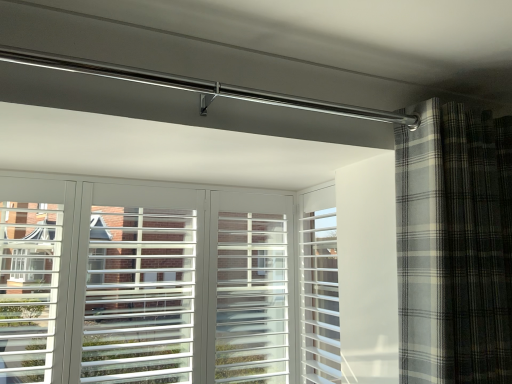
Question: Can white plastic screen door at center be found inside plaid fabric curtain at right?

Choices:
 (A) no
 (B) yes

Answer: (A)

Question: From a real-world perspective, is plaid fabric curtain at right beneath white plastic screen door at center?

Choices:
 (A) yes
 (B) no

Answer: (B)

Question: Is plaid fabric curtain at right shorter than white plastic screen door at center?

Choices:
 (A) yes
 (B) no

Answer: (A)

Question: Is white plastic screen door at center at the back of plaid fabric curtain at right?

Choices:
 (A) yes
 (B) no

Answer: (A)

Question: Considering the relative sizes of plaid fabric curtain at right and white plastic screen door at center in the image provided, is plaid fabric curtain at right thinner than white plastic screen door at center?

Choices:
 (A) no
 (B) yes

Answer: (A)

Question: Is plaid fabric curtain at right aimed at white plastic screen door at center?

Choices:
 (A) yes
 (B) no

Answer: (B)

Question: From the image's perspective, does white plastic screen door at center appear higher than plaid fabric curtain at right?

Choices:
 (A) yes
 (B) no

Answer: (B)

Question: Can you confirm if white plastic screen door at center is bigger than plaid fabric curtain at right?

Choices:
 (A) no
 (B) yes

Answer: (A)

Question: Considering the relative sizes of white plastic screen door at center and plaid fabric curtain at right in the image provided, is white plastic screen door at center taller than plaid fabric curtain at right?

Choices:
 (A) yes
 (B) no

Answer: (A)

Question: Can you confirm if white plastic screen door at center is smaller than plaid fabric curtain at right?

Choices:
 (A) yes
 (B) no

Answer: (A)

Question: Is there a large distance between white plastic screen door at center and plaid fabric curtain at right?

Choices:
 (A) yes
 (B) no

Answer: (B)

Question: Is white plastic screen door at center thinner than plaid fabric curtain at right?

Choices:
 (A) yes
 (B) no

Answer: (A)

Question: Based on their positions, is plaid fabric curtain at right located to the left or right of white plastic screen door at center?

Choices:
 (A) right
 (B) left

Answer: (A)